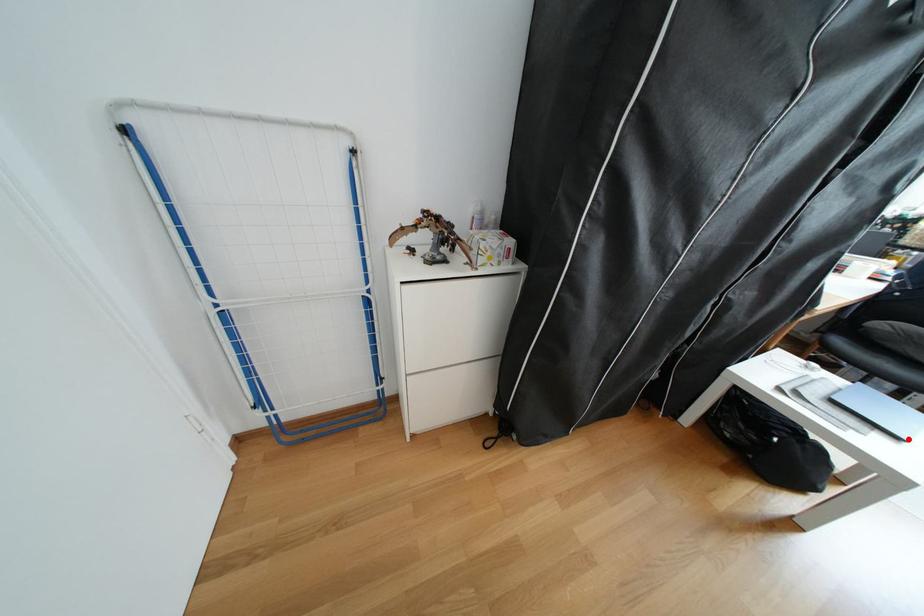
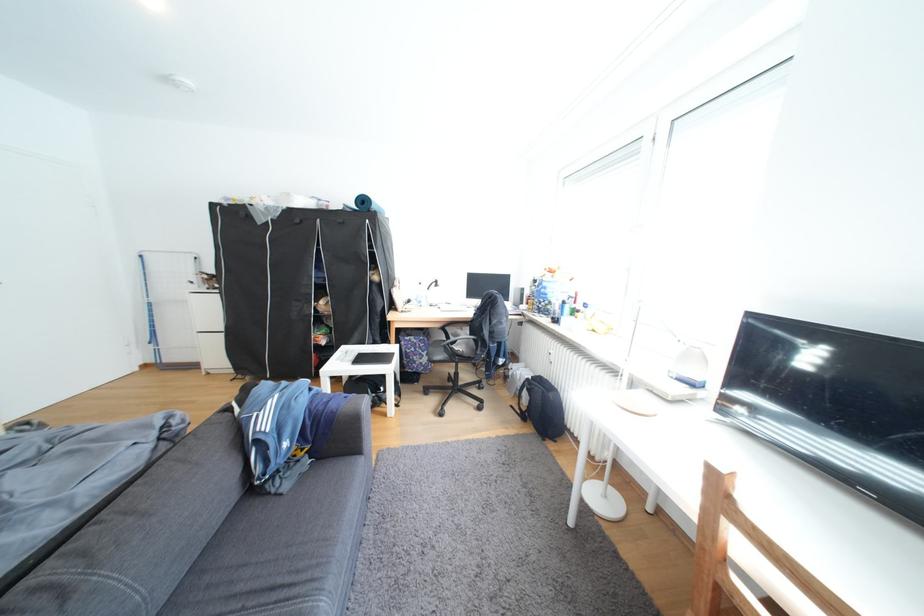
Question: I am providing you with two images of the same scene from different viewpoints. Given a red point in image1, look at the same physical point in image2. Is it:

Choices:
 (A) Closer to the viewpoint
 (B) Farther from the viewpoint

Answer: (B)